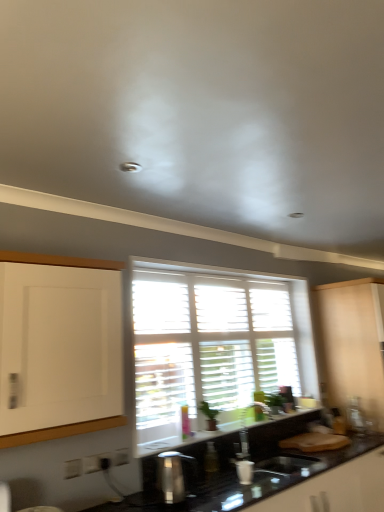
Where is `empty space that is ontop of black glossy countertop at lower center`? The image size is (384, 512). empty space that is ontop of black glossy countertop at lower center is located at coordinates [x=255, y=482].